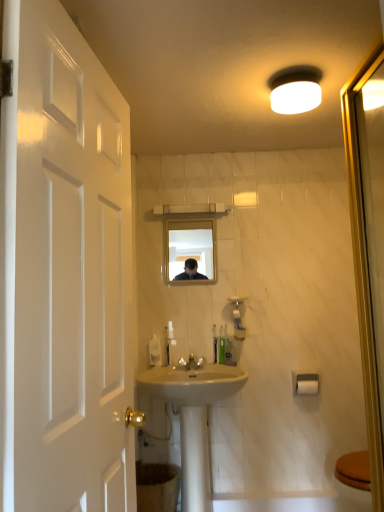
The image size is (384, 512). Identify the location of free location in front of green plastic toothbrush at center. [x=216, y=369].